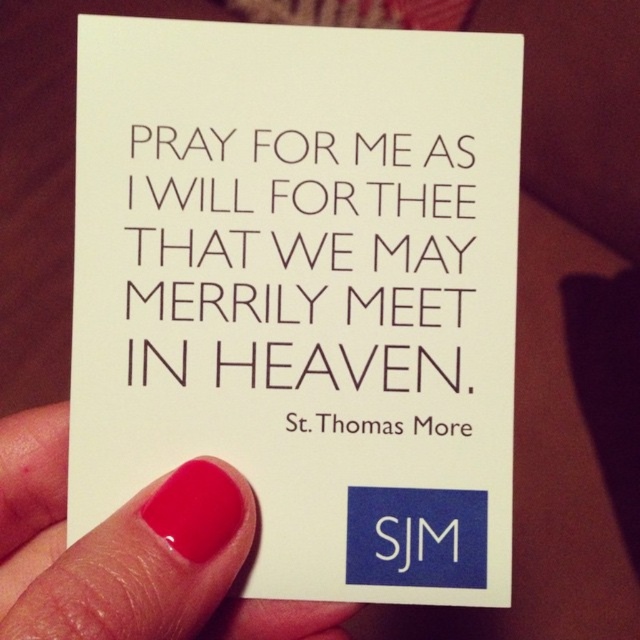
You are designing a layout for a greeting card and want to ensure the black paper text at center is positioned correctly relative to the white paper at center. According to the image, what is the minimum distance you should leave between them?

The black paper text at center should be placed at least 0.86 inches away from the white paper at center to match the image.

You are an art student analyzing this image for a project. You notice the black paper text at center and the pink nail polish at lower left. Which object is covering the other one?

The black paper text at center is positioned over the pink nail polish at lower left, meaning it is covering it.

You are a graphic designer reviewing a card design. The card has two elements you need to check. Based on the image, which element is closer to the viewer between the black paper text at center and the pink nail polish at lower left?

The black paper text at center is closer to the viewer than the pink nail polish at lower left.